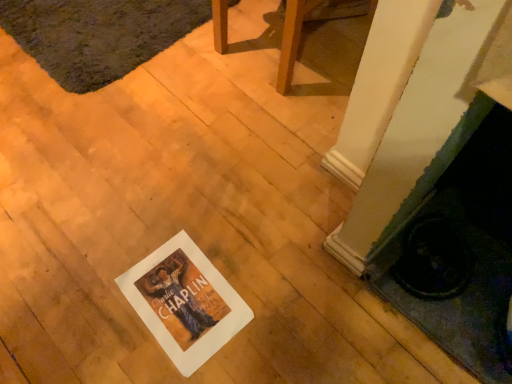
Where is `vacant space to the right of white paper at center`? The width and height of the screenshot is (512, 384). vacant space to the right of white paper at center is located at coordinates (271, 263).